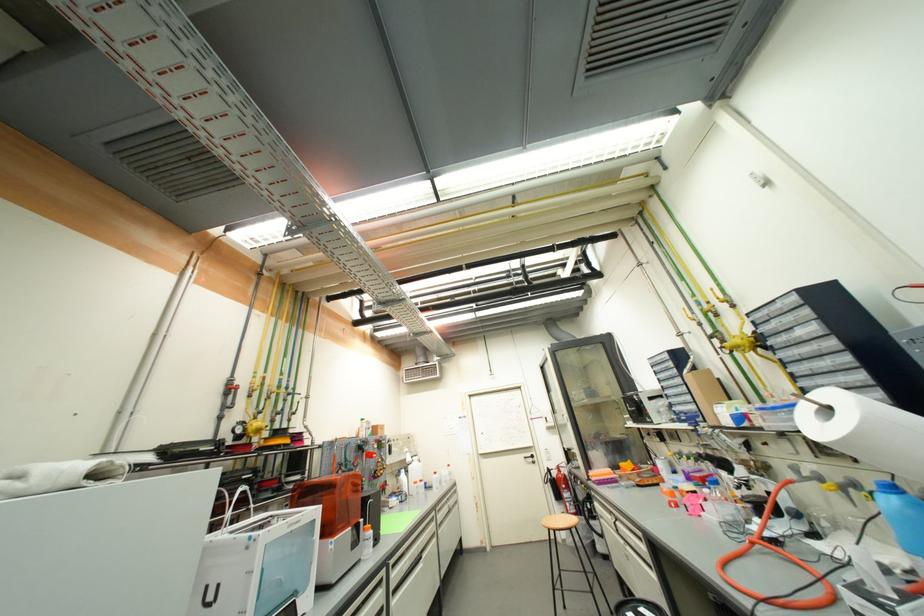
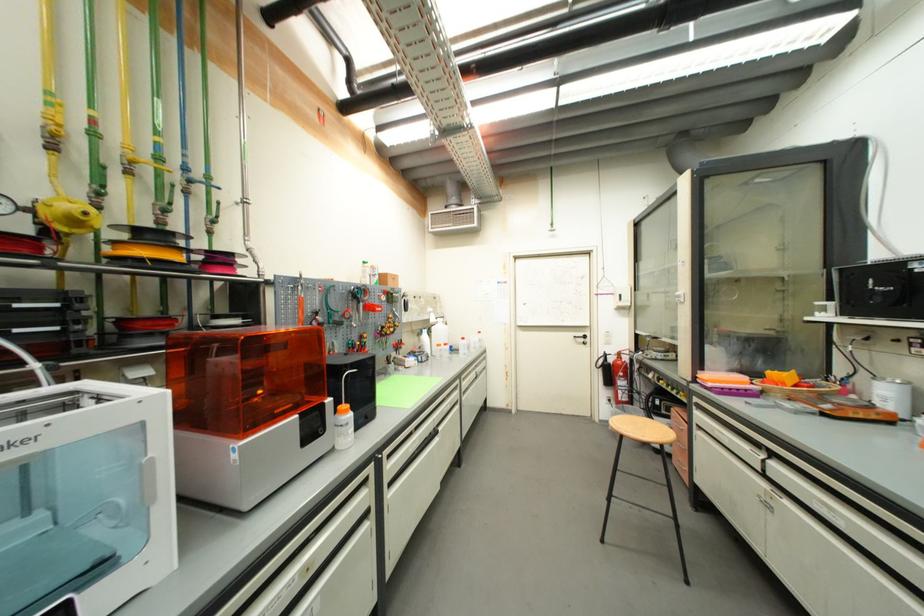
Locate, in the second image, the point that corresponds to (x=573, y=545) in the first image.

(615, 429)